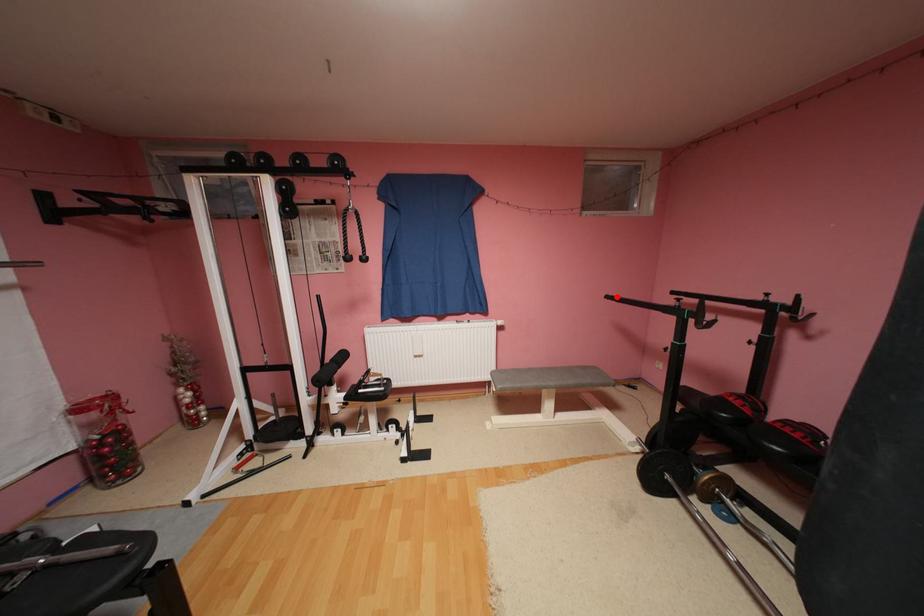
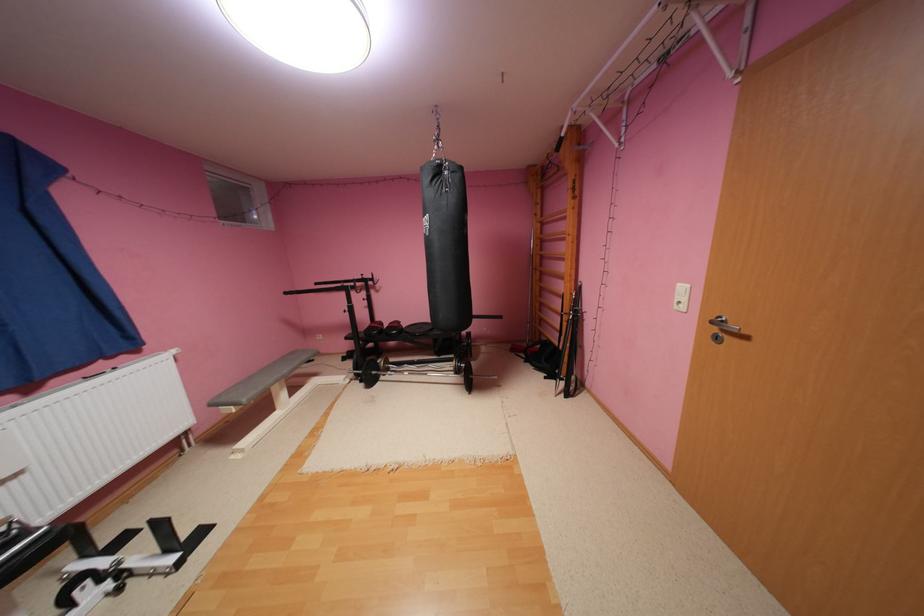
Question: I am providing you with two images of the same scene from different viewpoints. A red point is marked on the first image. At the location where the point appears in image 1, is it still visible in image 2?

Choices:
 (A) Yes
 (B) No

Answer: (A)